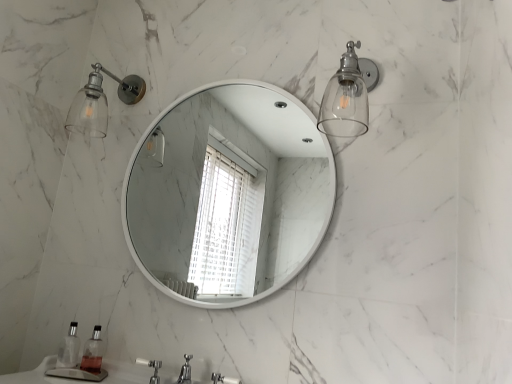
Question: Considering the relative sizes of white glossy mirror at center and white plastic faucet at lower center in the image provided, is white glossy mirror at center smaller than white plastic faucet at lower center?

Choices:
 (A) yes
 (B) no

Answer: (B)

Question: Is white plastic faucet at lower center a part of white glossy mirror at center?

Choices:
 (A) yes
 (B) no

Answer: (B)

Question: Is white glossy mirror at center not within white plastic faucet at lower center?

Choices:
 (A) yes
 (B) no

Answer: (A)

Question: Is white glossy mirror at center taller than white plastic faucet at lower center?

Choices:
 (A) yes
 (B) no

Answer: (A)

Question: Can you confirm if white glossy mirror at center is positioned to the left of white plastic faucet at lower center?

Choices:
 (A) no
 (B) yes

Answer: (A)

Question: Considering the positions of clear glass sconce at upper right and clear glass sconce at upper left in the image, is clear glass sconce at upper right bigger or smaller than clear glass sconce at upper left?

Choices:
 (A) big
 (B) small

Answer: (A)

Question: Is clear glass sconce at upper right inside or outside of clear glass sconce at upper left?

Choices:
 (A) inside
 (B) outside

Answer: (B)

Question: From the image's perspective, relative to clear glass sconce at upper left, is clear glass sconce at upper right above or below?

Choices:
 (A) above
 (B) below

Answer: (B)

Question: Is point (338, 81) closer or farther from the camera than point (83, 92)?

Choices:
 (A) farther
 (B) closer

Answer: (B)

Question: Looking at their shapes, would you say clear plastic soap dispenser at lower left, placed as the first soap dispenser when sorted from left to right, is wider or thinner than clear glass soap dispenser at lower left, the 1th soap dispenser from the right?

Choices:
 (A) wide
 (B) thin

Answer: (B)

Question: In terms of size, does clear plastic soap dispenser at lower left, placed as the first soap dispenser when sorted from left to right, appear bigger or smaller than clear glass soap dispenser at lower left, the 1th soap dispenser from the right?

Choices:
 (A) big
 (B) small

Answer: (A)

Question: Considering their positions, is clear plastic soap dispenser at lower left, which ranks as the second soap dispenser in right-to-left order, located in front of or behind clear glass soap dispenser at lower left, positioned as the second soap dispenser in left-to-right order?

Choices:
 (A) front
 (B) behind

Answer: (B)

Question: From the image's perspective, is clear plastic soap dispenser at lower left, placed as the first soap dispenser when sorted from left to right, positioned above or below clear glass soap dispenser at lower left, the 1th soap dispenser from the right?

Choices:
 (A) above
 (B) below

Answer: (A)

Question: Which is correct: clear glass sconce at upper right is inside white plastic faucet at lower center, or outside of it?

Choices:
 (A) outside
 (B) inside

Answer: (A)

Question: Is clear glass sconce at upper right taller or shorter than white plastic faucet at lower center?

Choices:
 (A) short
 (B) tall

Answer: (B)